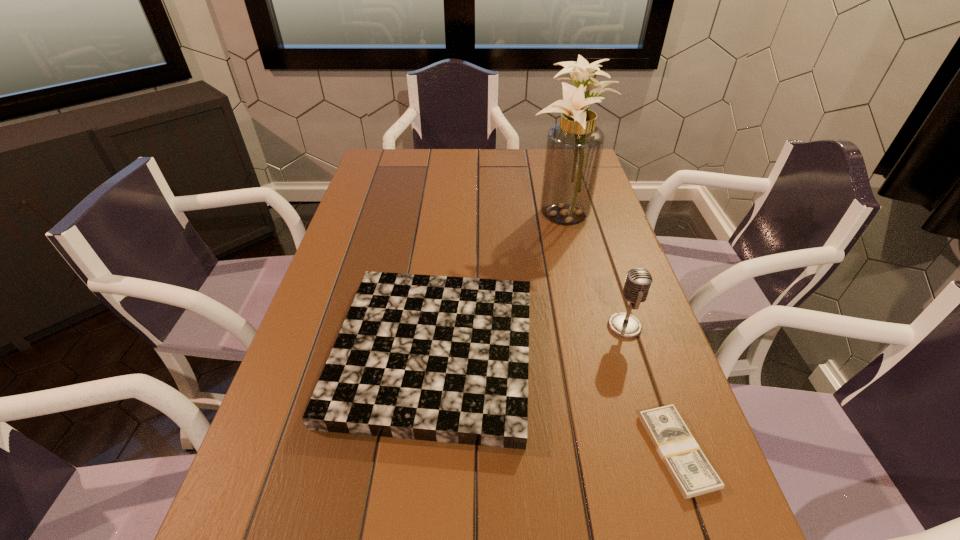
I want to click on vacant point that satisfies the following two spatial constraints: 1. on the front side of the shortest object; 2. on the left side of the tallest object, so click(x=620, y=451).